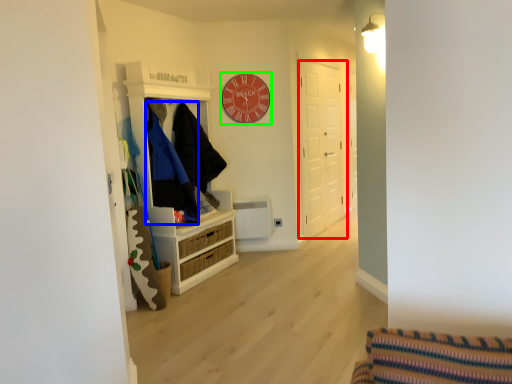
Question: Which is nearer to the door (highlighted by a red box)? clothing (highlighted by a blue box) or clock (highlighted by a green box).

Choices:
 (A) clothing
 (B) clock

Answer: (B)